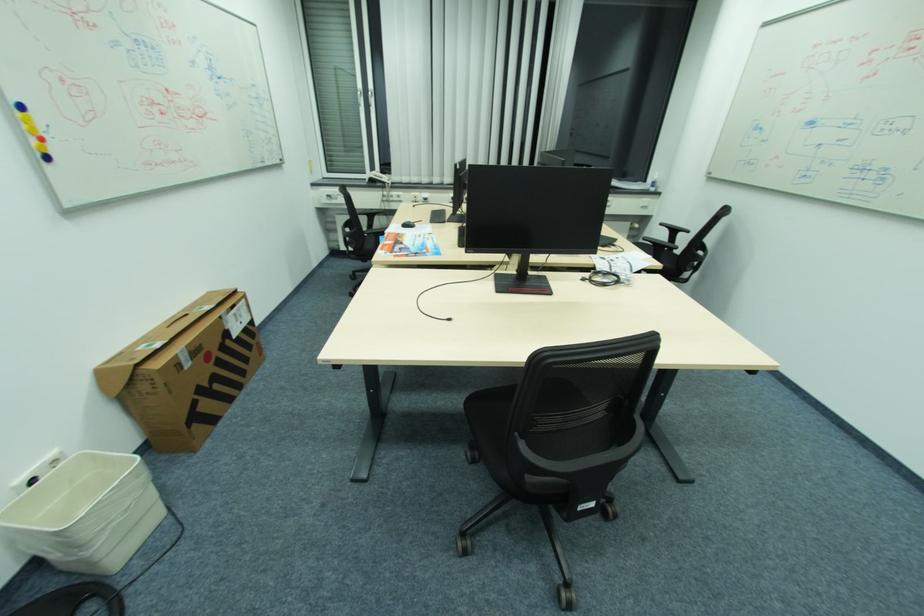
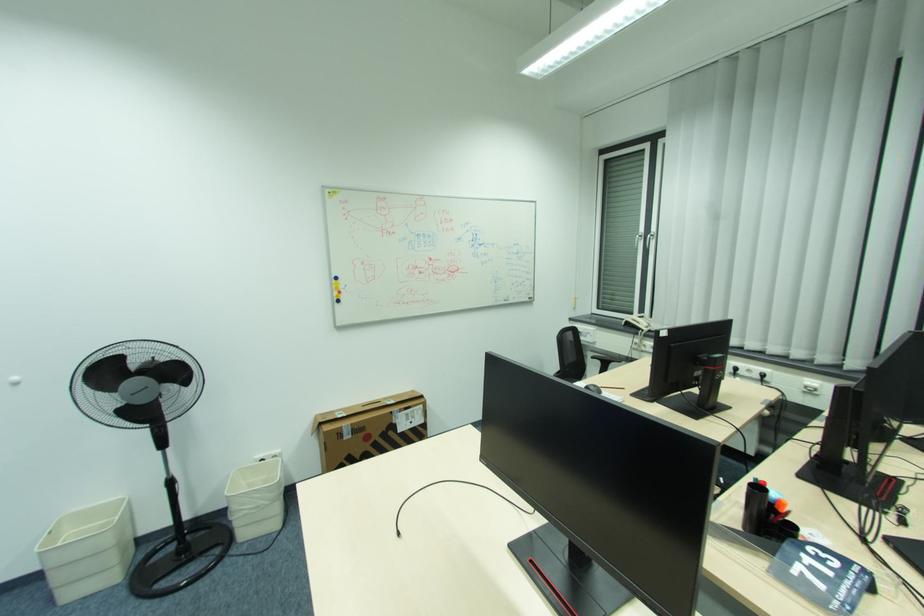
Locate, in the second image, the point that corresponds to [373,92] in the first image.

(653, 236)